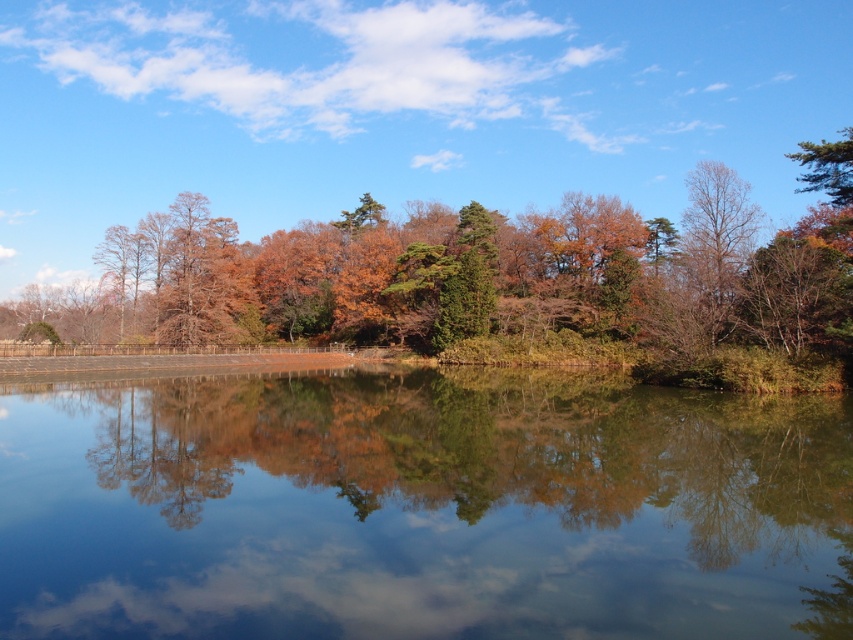
Question: Does green reflective water at center have a larger size compared to brown matte tree at upper left?

Choices:
 (A) yes
 (B) no

Answer: (B)

Question: Considering the real-world distances, which object is farthest from the brown matte tree at upper left?

Choices:
 (A) green matte tree at center
 (B) green reflective water at center

Answer: (B)

Question: Can you confirm if green matte tree at center is positioned above brown matte tree at upper left?

Choices:
 (A) no
 (B) yes

Answer: (B)

Question: Which point appears closest to the camera in this image?

Choices:
 (A) (216, 296)
 (B) (368, 435)
 (C) (434, 205)

Answer: (B)

Question: Can you confirm if green matte tree at center is smaller than brown matte tree at upper left?

Choices:
 (A) yes
 (B) no

Answer: (B)

Question: Which point appears closest to the camera in this image?

Choices:
 (A) (167, 237)
 (B) (549, 260)
 (C) (643, 621)

Answer: (C)